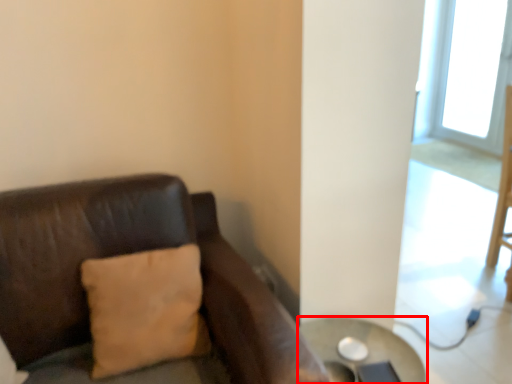
Question: Observing the image, what is the correct spatial positioning of table (annotated by the red box) in reference to pillow?

Choices:
 (A) right
 (B) left

Answer: (A)